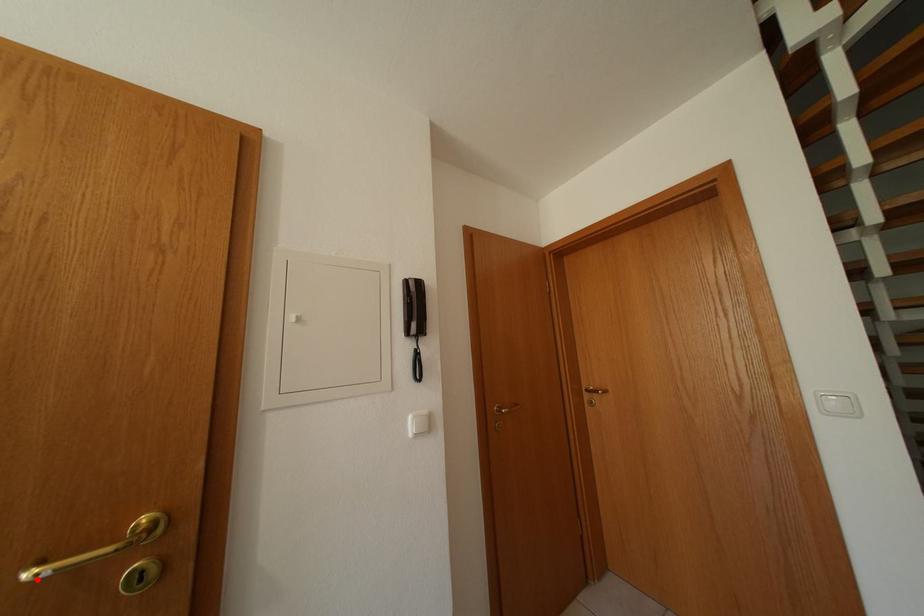
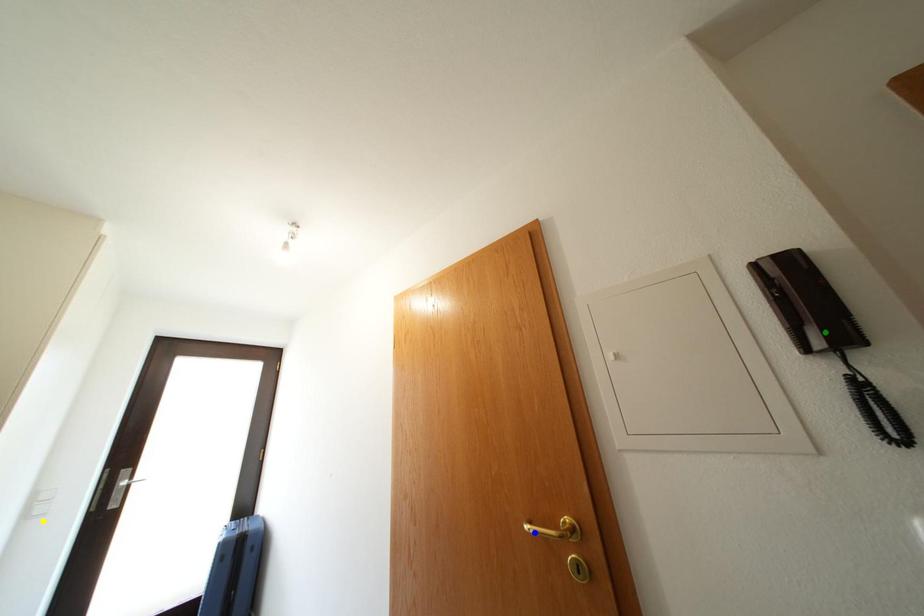
Question: I am providing you with two images of the same scene from different viewpoints. A red point is marked on the first image. You are given multiple points on the second image. Can you choose the point in image 2 that corresponds to the point in image 1?

Choices:
 (A) green point
 (B) yellow point
 (C) blue point

Answer: (C)